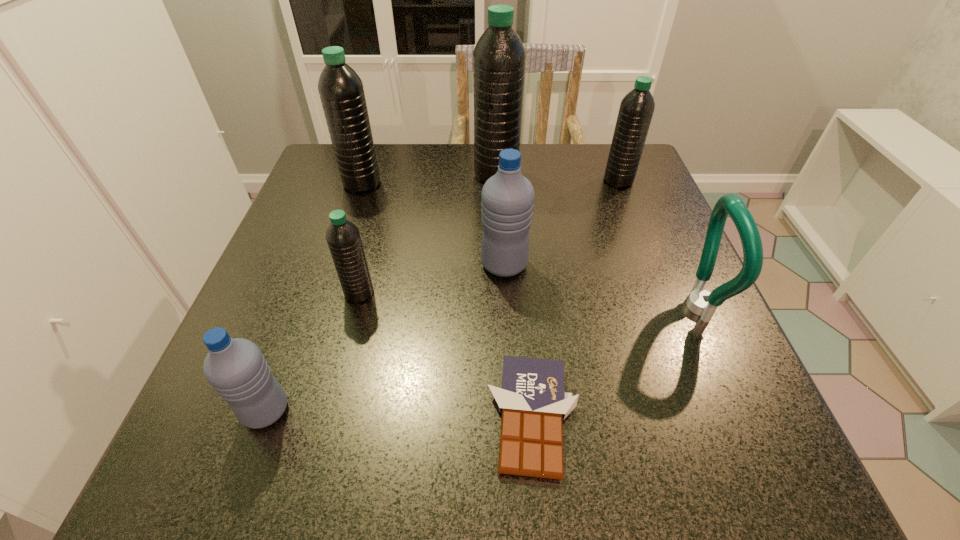
Identify the location of object that is positioned at the far right corner. tap(636, 109).

Find the location of a particular element. free space at the far edge of the desktop is located at coordinates (569, 150).

Find the location of `vacant space at the near edge`. vacant space at the near edge is located at coordinates (306, 450).

You are a GUI agent. You are given a task and a screenshot of the screen. Output one action in this format:
    pyautogui.click(x=<x>, y=<y>)
    Task: Click on the vacant space at the left edge of the desktop
    
    Given the screenshot: What is the action you would take?
    pyautogui.click(x=355, y=215)

In the image, there is a desktop. Where is `vacant space at the right edge`? vacant space at the right edge is located at coordinates (691, 370).

You are a GUI agent. You are given a task and a screenshot of the screen. Output one action in this format:
    pyautogui.click(x=<x>, y=<y>)
    Task: Click on the free point at the far left corner
    
    Given the screenshot: What is the action you would take?
    pos(328,182)

The image size is (960, 540). In order to click on free space between the fifth shortest water bottle and the fourth farthest water bottle in this screenshot , I will do `click(433, 224)`.

The image size is (960, 540). Find the location of `free space between the seventh shortest object and the shortest object`. free space between the seventh shortest object and the shortest object is located at coordinates (447, 300).

At what (x,y) coordinates should I click in order to perform the action: click on vacant space in between the bottle opener and the nearest water bottle. Please return your answer as a coordinate pair (x, y). This screenshot has width=960, height=540. Looking at the image, I should click on (480, 359).

At what (x,y) coordinates should I click in order to perform the action: click on empty space between the smallest black water bottle and the second black water bottle from right to left. Please return your answer as a coordinate pair (x, y). Looking at the image, I should click on (427, 234).